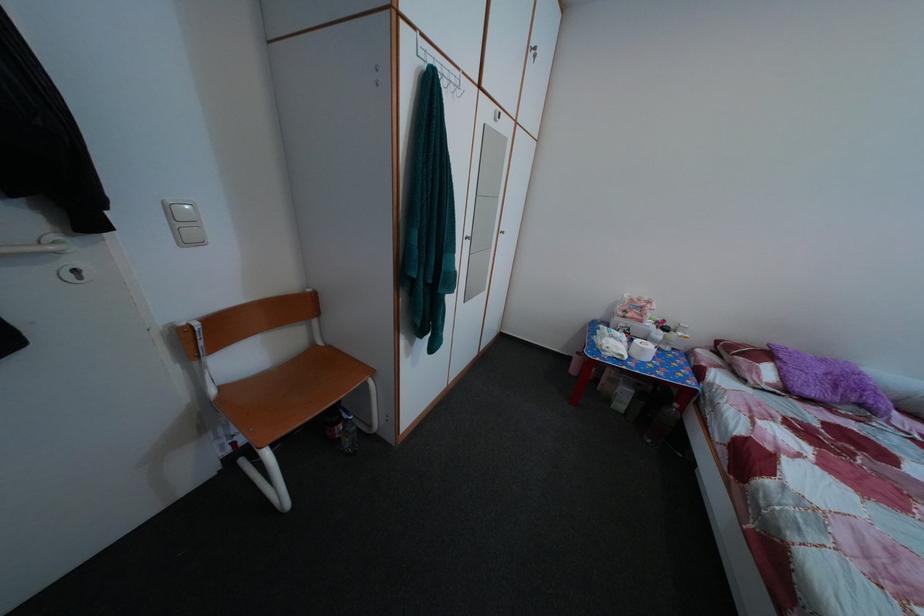
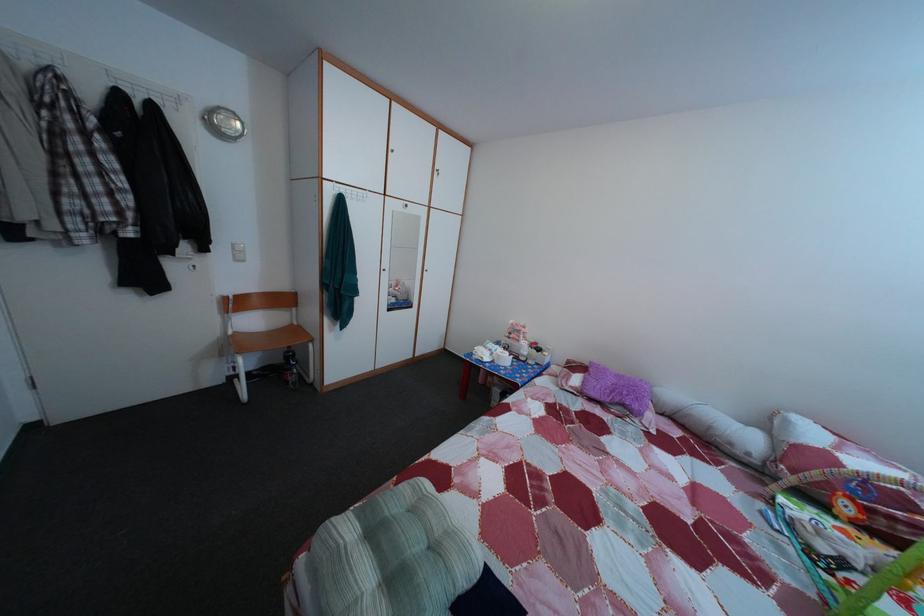
Locate, in the second image, the point that corresponds to [177,216] in the first image.

(242, 254)